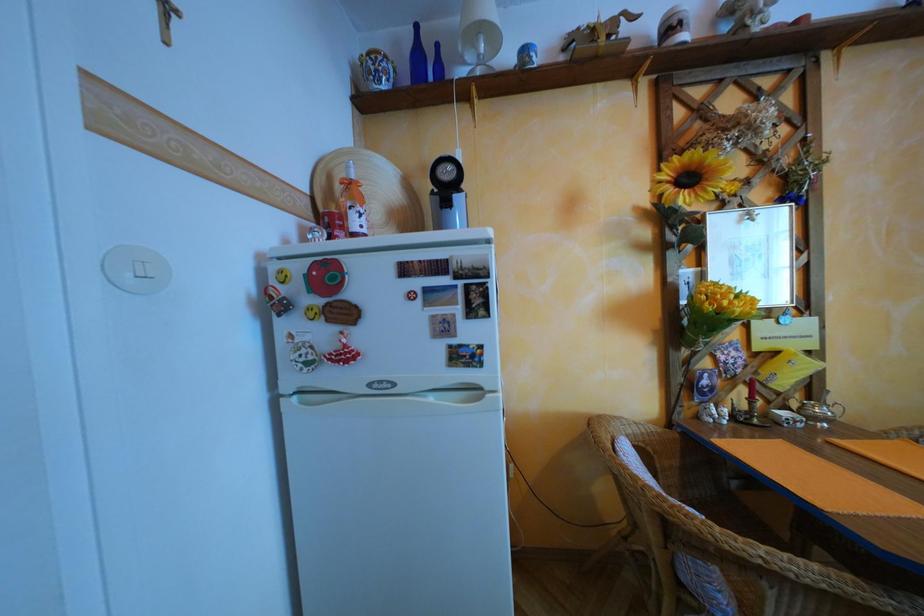
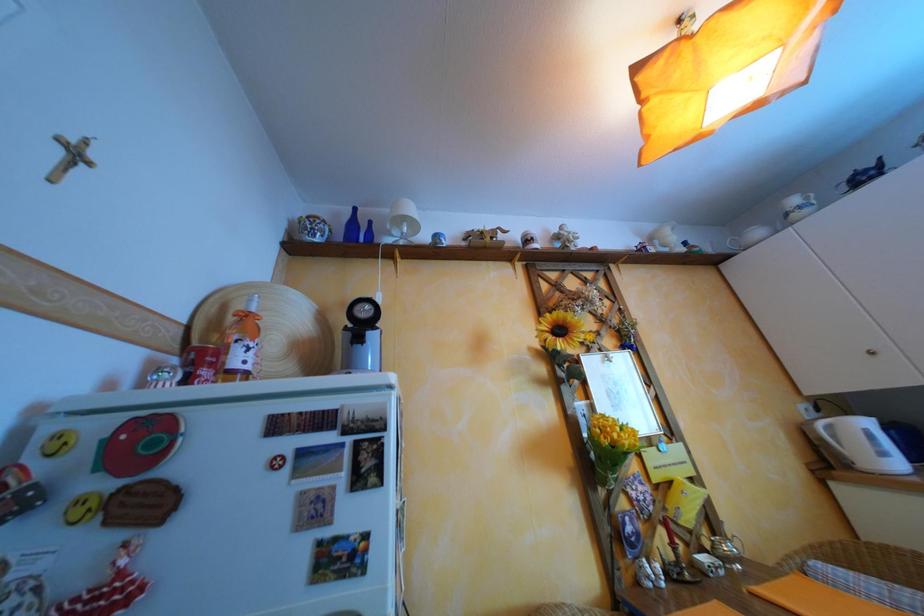
How did the camera likely rotate?

The camera rotated toward right-up.